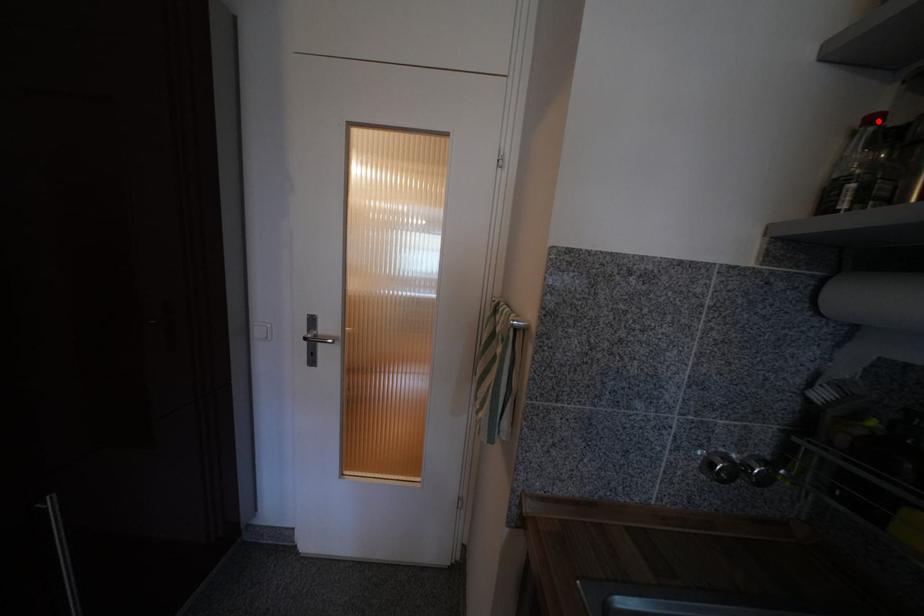
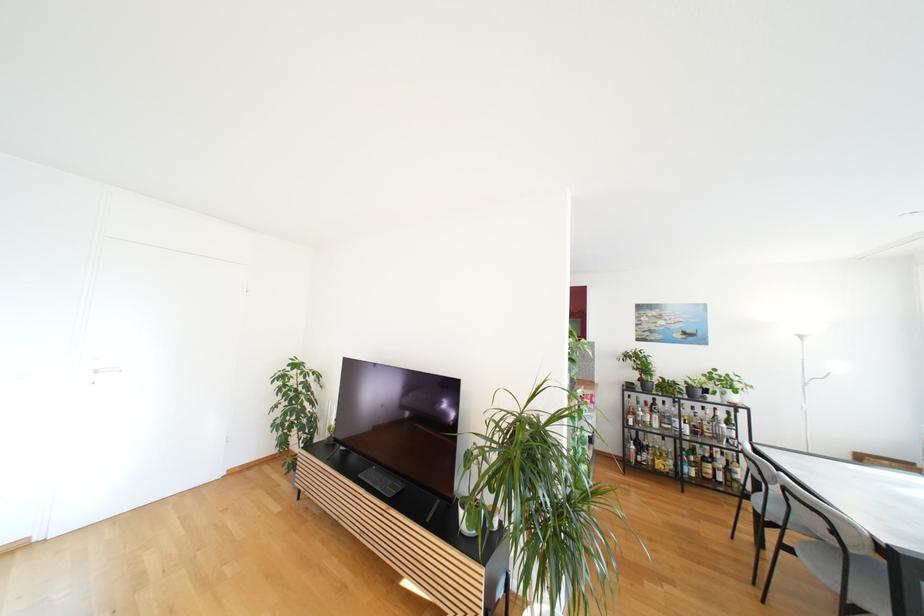
Question: I am providing you with two images of the same scene from different viewpoints. A red point is marked on the first image. At the location where the point appears in image 1, is it still visible in image 2?

Choices:
 (A) Yes
 (B) No

Answer: (B)